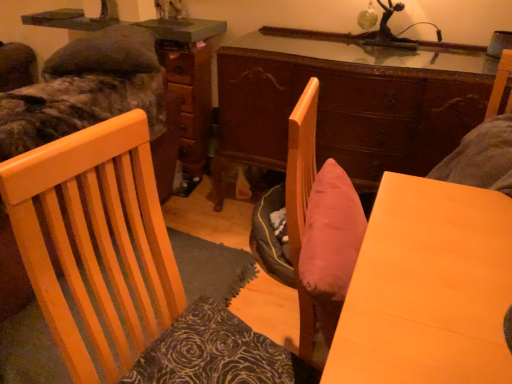
Question: Is wooden dresser at center far away from camouflage fabric bed at upper left, arranged as the first bed when viewed from the top?

Choices:
 (A) no
 (B) yes

Answer: (A)

Question: Can you confirm if wooden dresser at center is bigger than camouflage fabric bed at upper left, acting as the second bed starting from the bottom?

Choices:
 (A) no
 (B) yes

Answer: (A)

Question: Is wooden dresser at center aimed at camouflage fabric bed at upper left, arranged as the first bed when viewed from the top?

Choices:
 (A) yes
 (B) no

Answer: (A)

Question: From the image's perspective, is wooden dresser at center located beneath camouflage fabric bed at upper left, arranged as the first bed when viewed from the top?

Choices:
 (A) no
 (B) yes

Answer: (B)

Question: Can you confirm if wooden dresser at center is smaller than camouflage fabric bed at upper left, acting as the second bed starting from the bottom?

Choices:
 (A) no
 (B) yes

Answer: (B)

Question: Is wooden dresser at center closer to the viewer compared to camouflage fabric bed at upper left, arranged as the first bed when viewed from the top?

Choices:
 (A) no
 (B) yes

Answer: (A)

Question: Is wooden chair at center thinner than wooden table at center?

Choices:
 (A) yes
 (B) no

Answer: (A)

Question: Is wooden chair at center in front of wooden table at center?

Choices:
 (A) no
 (B) yes

Answer: (B)

Question: Is wooden chair at center with wooden table at center?

Choices:
 (A) no
 (B) yes

Answer: (A)

Question: Is wooden chair at center not close to wooden table at center?

Choices:
 (A) yes
 (B) no

Answer: (B)

Question: From the image's perspective, is wooden chair at center above wooden table at center?

Choices:
 (A) no
 (B) yes

Answer: (B)

Question: From a real-world perspective, is wooden chair at center beneath wooden table at center?

Choices:
 (A) no
 (B) yes

Answer: (A)

Question: Is wooden dresser at center facing towards dark brown textured pillow at lower left?

Choices:
 (A) no
 (B) yes

Answer: (A)